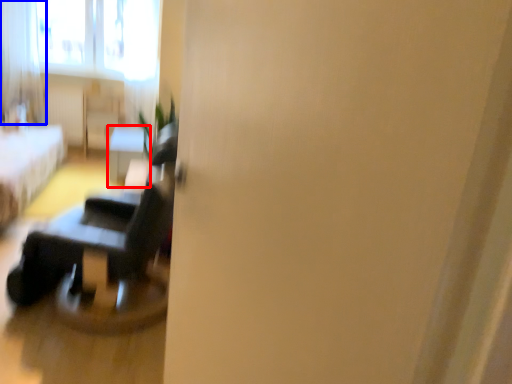
Question: Which object is further to the camera taking this photo, table (highlighted by a red box) or curtain (highlighted by a blue box)?

Choices:
 (A) table
 (B) curtain

Answer: (B)